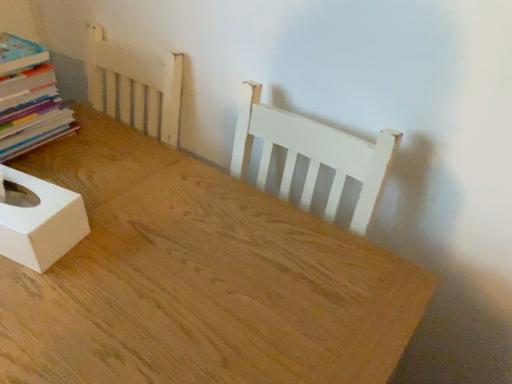
Question: Is white matte tissue box at lower left bigger or smaller than natural wood table at center?

Choices:
 (A) big
 (B) small

Answer: (B)

Question: Looking at their shapes, would you say white matte tissue box at lower left is wider or thinner than natural wood table at center?

Choices:
 (A) thin
 (B) wide

Answer: (A)

Question: Based on their relative distances, which object is farther from the multicolored paper stack at left?

Choices:
 (A) natural wood table at center
 (B) white matte tissue box at lower left

Answer: (A)

Question: Based on their relative distances, which object is nearer to the multicolored paper stack at left?

Choices:
 (A) white matte tissue box at lower left
 (B) natural wood table at center

Answer: (A)